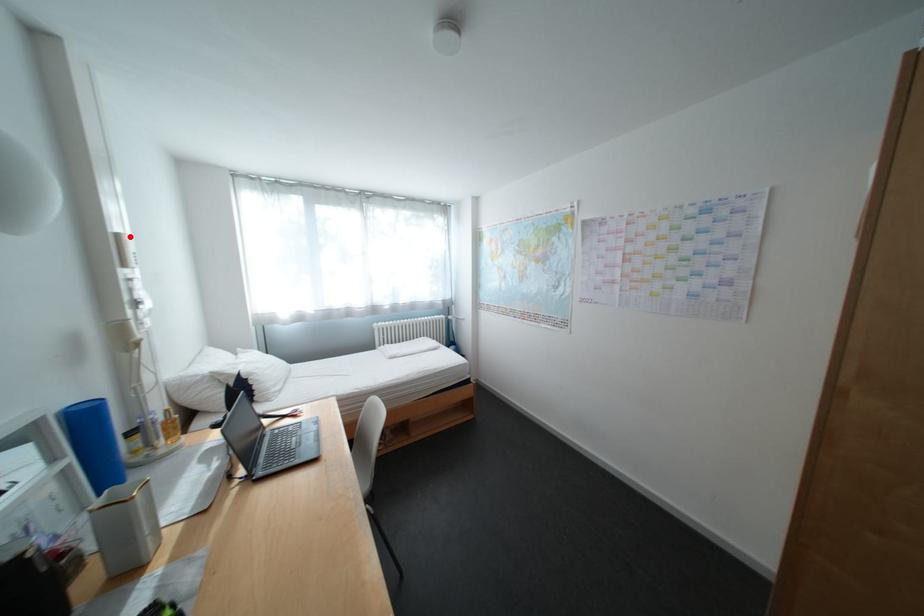
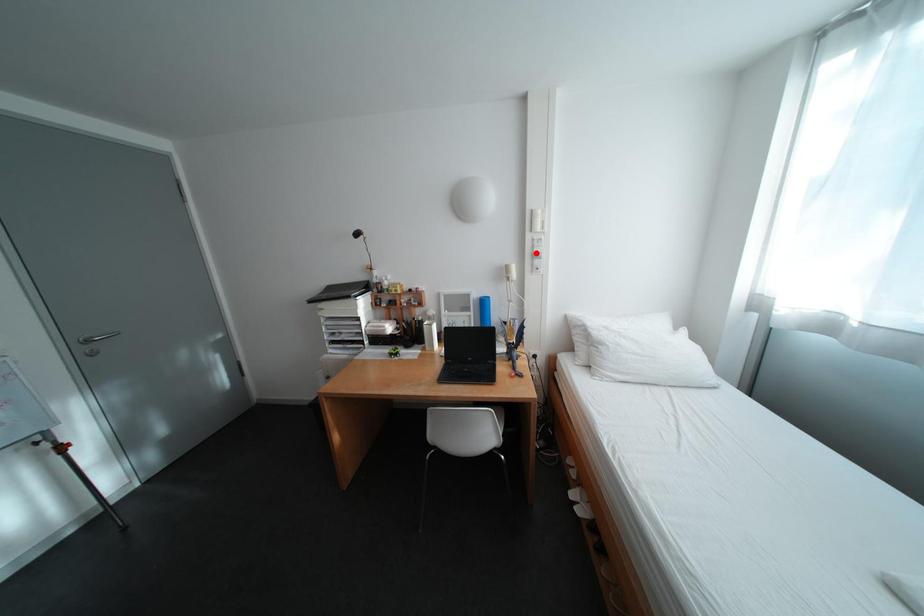
I am providing you with two images of the same scene from different viewpoints. A red point is marked on the first image and another point is marked on the second image. Is the red point in image1 aligned with the point shown in image2?

No